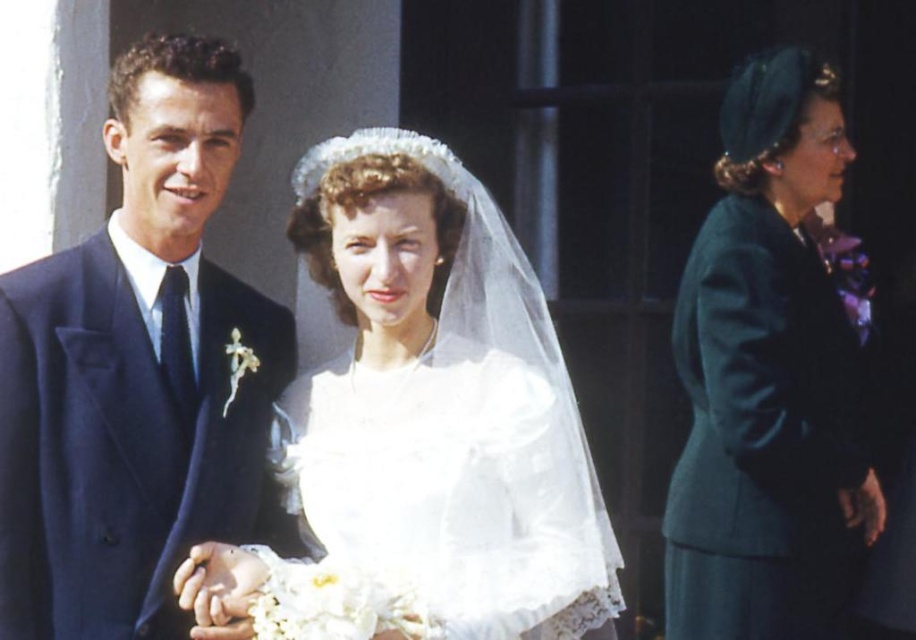
Can you confirm if white satin dress at center is positioned to the left of teal woolen coat at right?

Indeed, white satin dress at center is positioned on the left side of teal woolen coat at right.

Is white satin dress at center thinner than teal woolen coat at right?

Incorrect, white satin dress at center's width is not less than teal woolen coat at right's.

Who is more distant from viewer, (326, 529) or (709, 557)?

The point (709, 557) is behind.

Locate an element on the screen. white satin dress at center is located at coordinates (422, 428).

Does white satin dress at center have a greater width compared to navy blue suit at left?

Correct, the width of white satin dress at center exceeds that of navy blue suit at left.

Is white satin dress at center to the left of navy blue suit at left from the viewer's perspective?

In fact, white satin dress at center is to the right of navy blue suit at left.

Is point (486, 314) more distant than point (97, 387)?

Yes, it is.

Image resolution: width=916 pixels, height=640 pixels. I want to click on white satin dress at center, so click(x=422, y=428).

Does navy blue suit at left come in front of pearl/textured tiara at center?

Yes, navy blue suit at left is closer to the viewer.

Find the location of a particular element. The height and width of the screenshot is (640, 916). navy blue suit at left is located at coordinates 135,371.